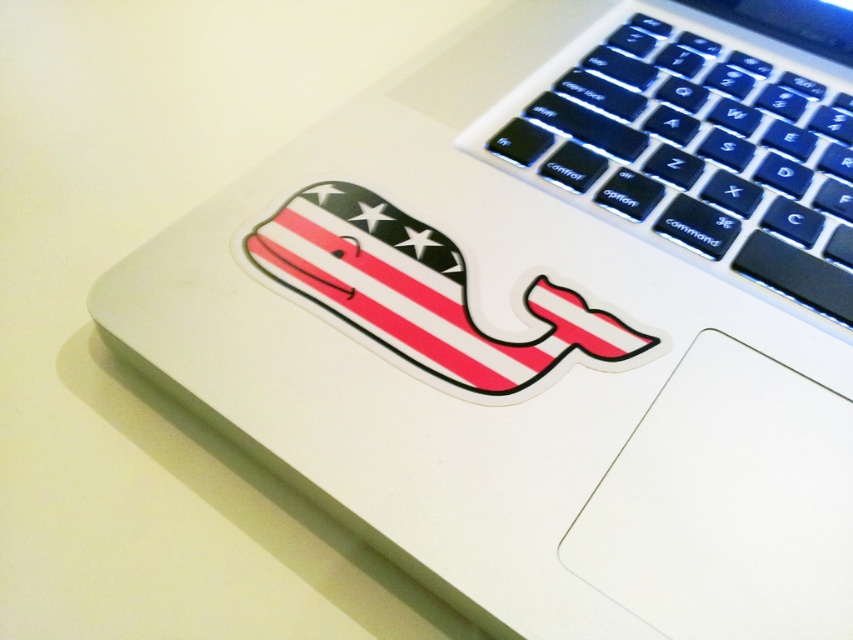
Question: Does black plastic keyboard at upper right come in front of american flag whale sticker at center?

Choices:
 (A) yes
 (B) no

Answer: (B)

Question: In this image, where is black plastic keyboard at upper right located relative to american flag whale sticker at center?

Choices:
 (A) right
 (B) left

Answer: (A)

Question: Which object appears farthest from the camera in this image?

Choices:
 (A) american flag whale sticker at center
 (B) black plastic keyboard at upper right

Answer: (B)

Question: Which point is closer to the camera?

Choices:
 (A) american flag whale sticker at center
 (B) black plastic keyboard at upper right

Answer: (A)

Question: Among these objects, which one is farthest from the camera?

Choices:
 (A) black plastic keyboard at upper right
 (B) american flag whale sticker at center

Answer: (A)

Question: Is black plastic keyboard at upper right positioned behind american flag whale sticker at center?

Choices:
 (A) yes
 (B) no

Answer: (A)